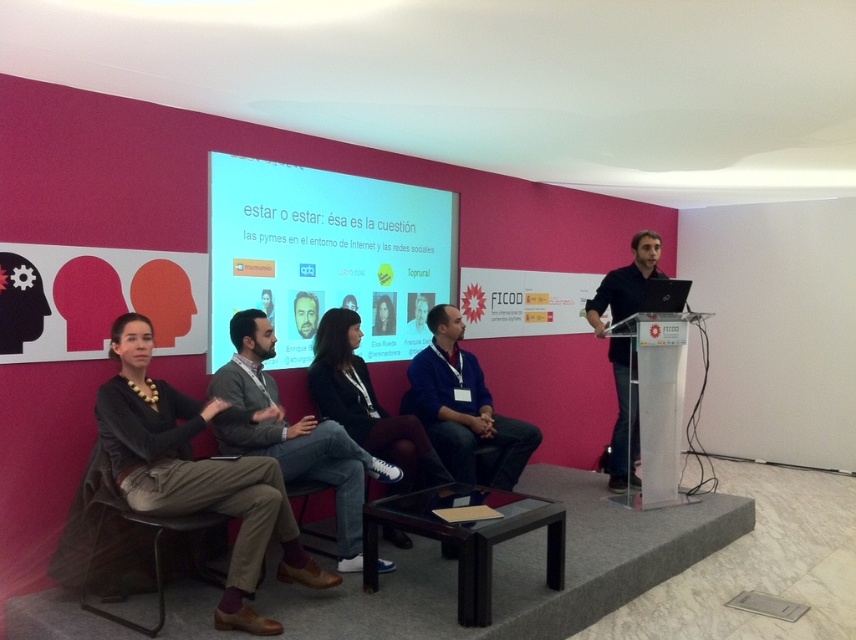
From the picture: You are organizing a photo shoot for a clothing brand and need to arrange two sweaters for a promotional image. The dark gray sweater at left and the gray sweater at center must be placed on a mannequin. Which sweater should you choose if you want the one that appears bigger in the photo?

The dark gray sweater at left should be chosen because it is larger in size than the gray sweater at center, making it appear bigger in the photo.

You are sitting in the front row of the conference room and want to hand a note to the person wearing the black matte shirt at right. To do this, you need to pass the note over the matte plastic screen at center. Is the screen in your way?

The matte plastic screen at center is closer to the viewer than the black matte shirt at right, meaning the screen is between you and the shirt. Therefore, you would need to go around the screen to reach the person wearing the black matte shirt at right.